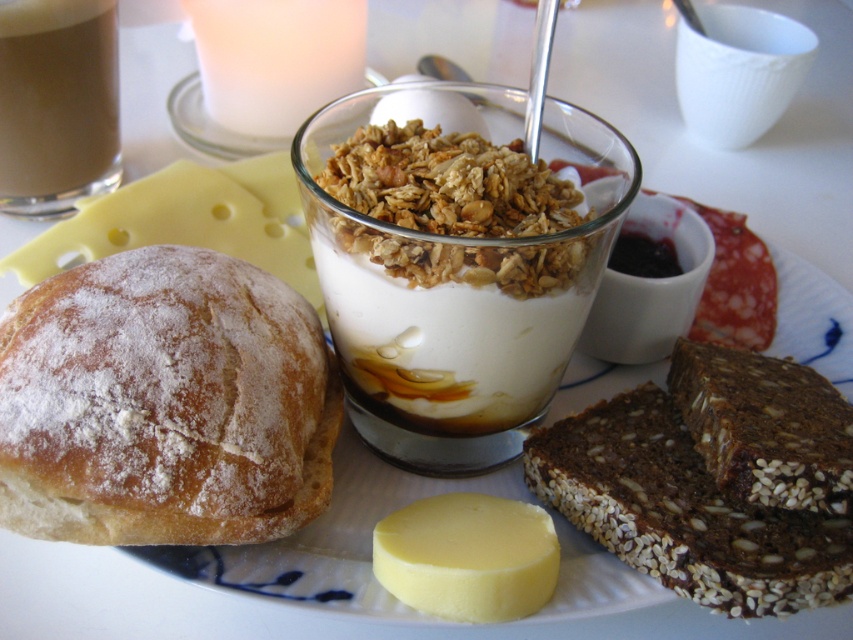
Question: Which point is closer to the camera taking this photo?

Choices:
 (A) (61, 397)
 (B) (392, 548)
 (C) (775, 413)
 (D) (83, 141)

Answer: (A)

Question: Considering the real-world distances, which object is farthest from the yellow creamy cheese at center?

Choices:
 (A) smooth brown liquid at upper left
 (B) brown seeded bread at lower right

Answer: (A)

Question: Is seeded brown bread at lower right bigger than yellow creamy cheese at center?

Choices:
 (A) yes
 (B) no

Answer: (A)

Question: Does brown seeded bread at lower right appear under smooth brown liquid at upper left?

Choices:
 (A) yes
 (B) no

Answer: (A)

Question: Which object appears closest to the camera in this image?

Choices:
 (A) smooth brown liquid at upper left
 (B) brown seeded bread at lower right
 (C) yellow creamy cheese at center
 (D) seeded brown bread at lower right

Answer: (B)

Question: Is brown seeded bread at lower right to the right of yellow creamy cheese at center from the viewer's perspective?

Choices:
 (A) yes
 (B) no

Answer: (A)